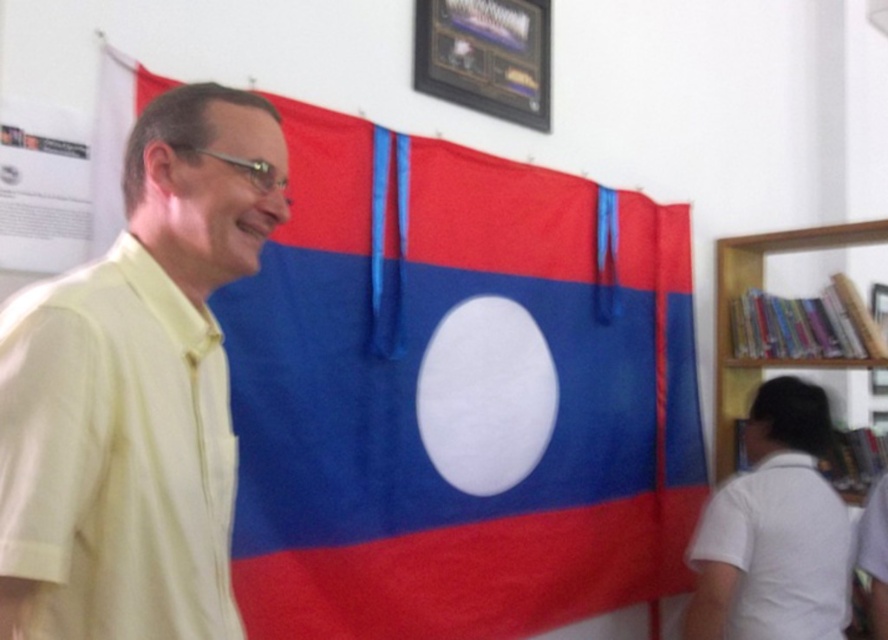
Can you confirm if white matte shirt at lower right is positioned below wooden bookshelf at right?

Correct, white matte shirt at lower right is located below wooden bookshelf at right.

Which is in front, point (822, 429) or point (817, 362)?

Point (822, 429) is in front.

In order to click on white matte shirt at lower right in this screenshot , I will do `click(774, 531)`.

Between textured fabric flag at center and wooden bookshelf at right, which one appears on the right side from the viewer's perspective?

wooden bookshelf at right is more to the right.

Who is shorter, textured fabric flag at center or wooden bookshelf at right?

wooden bookshelf at right is shorter.

The width and height of the screenshot is (888, 640). I want to click on textured fabric flag at center, so click(x=457, y=394).

Who is shorter, textured fabric flag at center or metallic framed certificate at upper center?

metallic framed certificate at upper center

Which is in front, point (553, 221) or point (522, 86)?

Point (522, 86) is in front.

The image size is (888, 640). In order to click on textured fabric flag at center in this screenshot , I will do `click(457, 394)`.